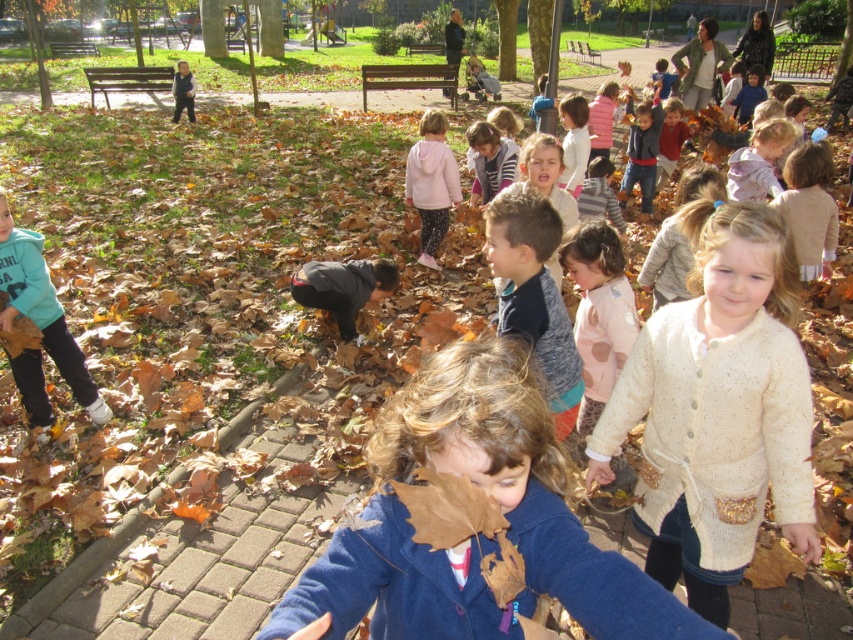
Question: Among these points, which one is nearest to the camera?

Choices:
 (A) (782, 404)
 (B) (434, 243)

Answer: (A)

Question: Is blue woolen jacket at center bigger than white knitted sweater at center?

Choices:
 (A) no
 (B) yes

Answer: (A)

Question: Does white knitted sweater at center have a greater width compared to matte teal hoodie at lower left?

Choices:
 (A) yes
 (B) no

Answer: (A)

Question: Which point is closer to the camera taking this photo?

Choices:
 (A) (460, 196)
 (B) (24, 244)
 (C) (561, 520)
 (D) (804, 500)

Answer: (C)

Question: Is blue woolen jacket at center above matte teal hoodie at lower left?

Choices:
 (A) yes
 (B) no

Answer: (B)

Question: Which of the following is the farthest from the observer?

Choices:
 (A) matte teal hoodie at lower left
 (B) pink fleece jacket at center
 (C) blue woolen jacket at center

Answer: (B)